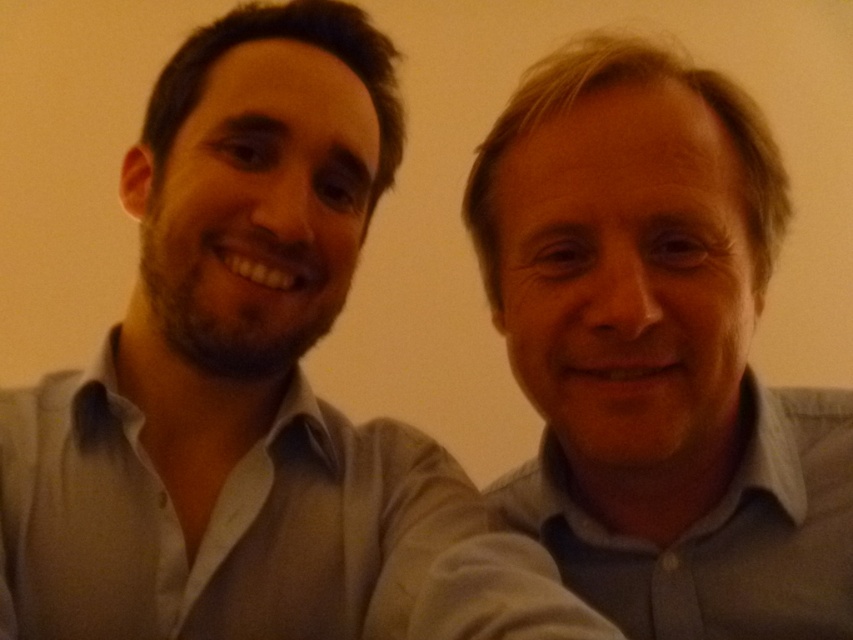
Based on the photo, you are trying to figure out the arrangement of the shirts in the image. According to the description, where is the gray shirt at right located in relation to the gray cotton shirt at right?

The gray shirt at right is positioned to the left of the gray cotton shirt at right.

Looking at this image, you are holding a 12 inch ruler and want to measure the distance between the point at coordinates point (479, 589) and yourself. Can you fit the ruler to measure this distance?

The distance between the point at coordinates point (479, 589) and the viewer is 19.45 inches. Since the ruler is 12 inches long, it is not long enough to measure the distance. You would need a ruler that is at least 19.45 inches long.

You are a photographer trying to adjust the lighting for a group photo. You notice two gray shirts in the scene. Which one is taller between the gray shirt at right and the gray cotton shirt at right?

The gray shirt at right is taller than the gray cotton shirt at right.